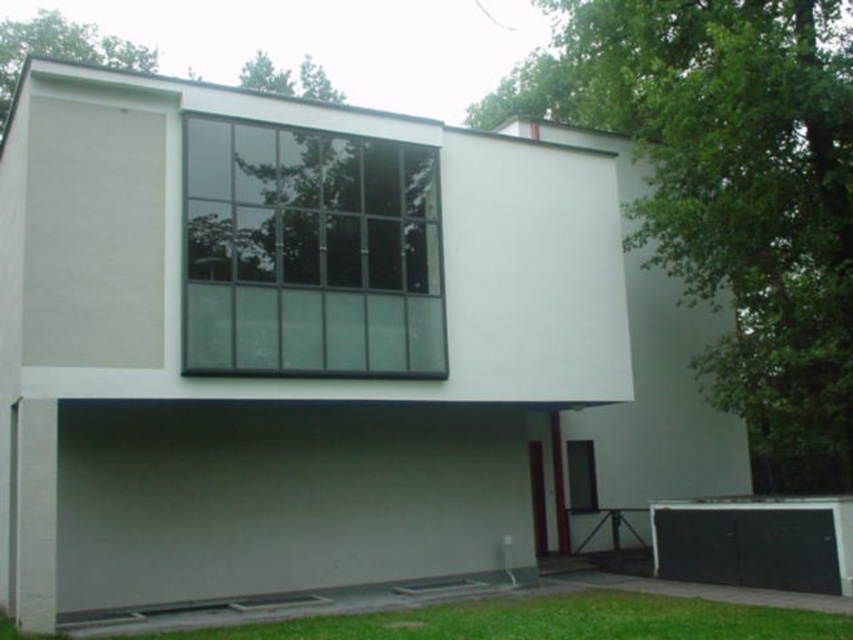
Measure the distance between transparent glass window at center and camera.

A distance of 11.85 meters exists between transparent glass window at center and camera.

Does point (405, 284) come behind point (834, 540)?

Yes, it is behind point (834, 540).

Is point (194, 323) farther from camera compared to point (758, 540)?

No, (194, 323) is in front of (758, 540).

You are a GUI agent. You are given a task and a screenshot of the screen. Output one action in this format:
    pyautogui.click(x=<x>, y=<y>)
    Task: Click on the transparent glass window at center
    This screenshot has width=853, height=640.
    Given the screenshot: What is the action you would take?
    pyautogui.click(x=309, y=253)